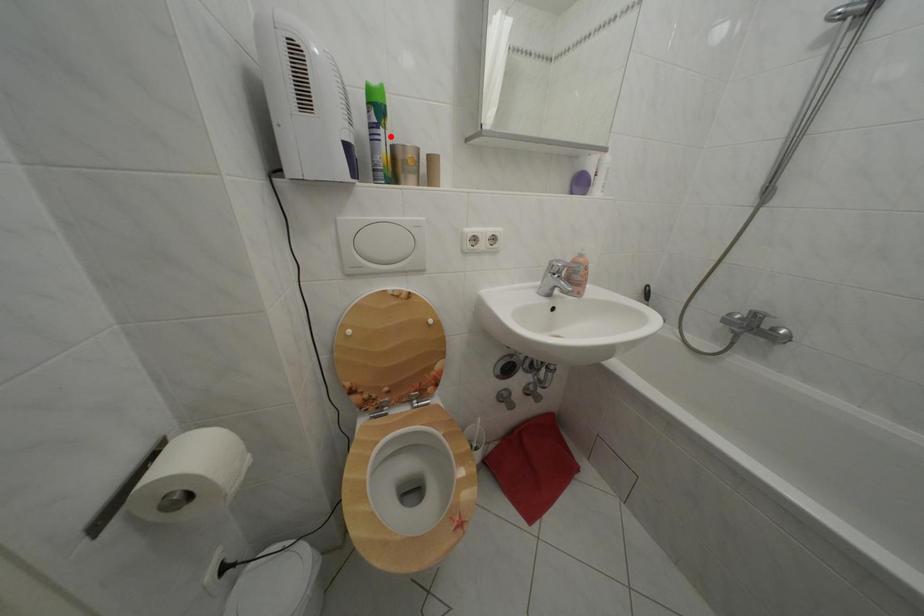
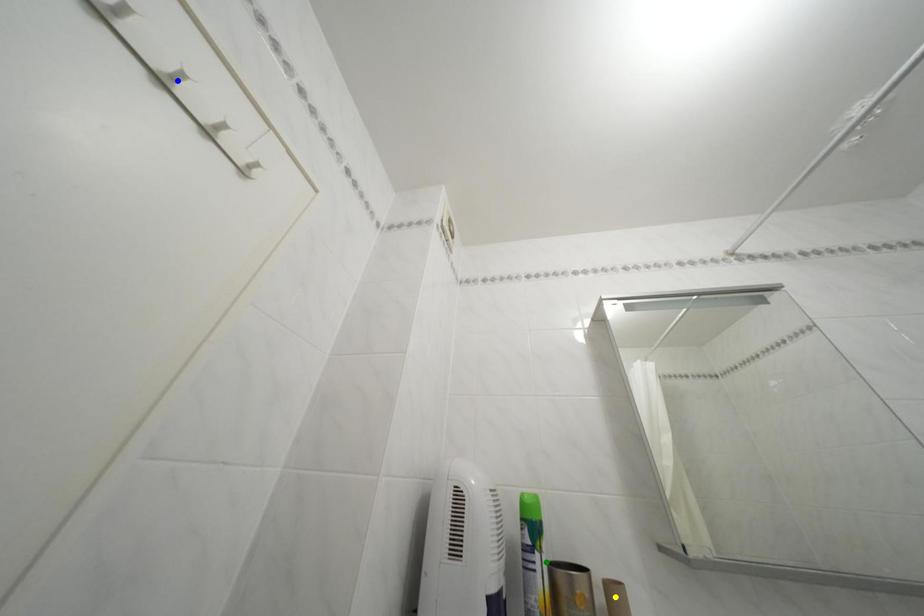
Question: I am providing you with two images of the same scene from different viewpoints. A red point is marked on the first image. You are given multiple points on the second image. Can you choose the point in image 2 that corresponds to the point in image 1?

Choices:
 (A) green point
 (B) blue point
 (C) yellow point

Answer: (A)